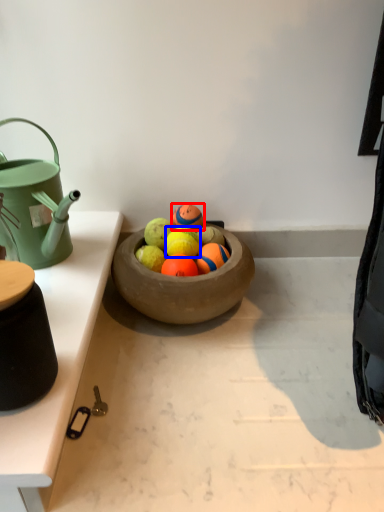
Question: Which of the following is the farthest to the observer, tennis ball (highlighted by a red box) or fruit (highlighted by a blue box)?

Choices:
 (A) tennis ball
 (B) fruit

Answer: (A)